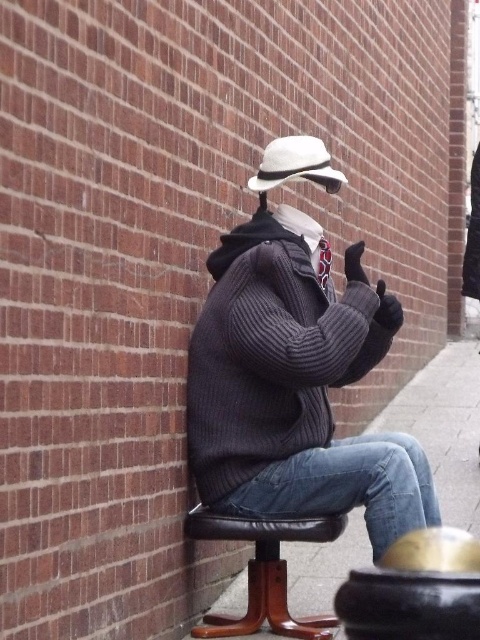
Question: Which object is farther from the camera taking this photo?

Choices:
 (A) black leather stool at lower center
 (B) jeans at lower right

Answer: (B)

Question: Which object appears closest to the camera in this image?

Choices:
 (A) white felt hat at center
 (B) black leather stool at lower center
 (C) knitted sweater at center
 (D) jeans at lower right

Answer: (C)

Question: Is the position of black leather stool at lower center less distant than that of white felt hat at center?

Choices:
 (A) yes
 (B) no

Answer: (A)

Question: Is knitted sweater at center smaller than white felt hat at center?

Choices:
 (A) no
 (B) yes

Answer: (A)

Question: Which point is farther from the camera taking this photo?

Choices:
 (A) (339, 545)
 (B) (241, 442)
 (C) (194, 636)
 (D) (336, 176)

Answer: (A)

Question: Does knitted sweater at center have a greater width compared to black leather stool at lower center?

Choices:
 (A) yes
 (B) no

Answer: (A)